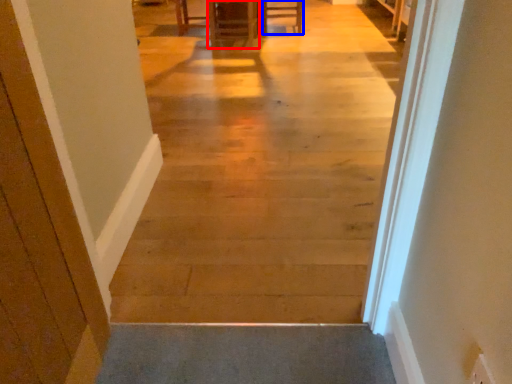
Question: Which point is closer to the camera, furniture (highlighted by a red box) or furniture (highlighted by a blue box)?

Choices:
 (A) furniture
 (B) furniture

Answer: (A)